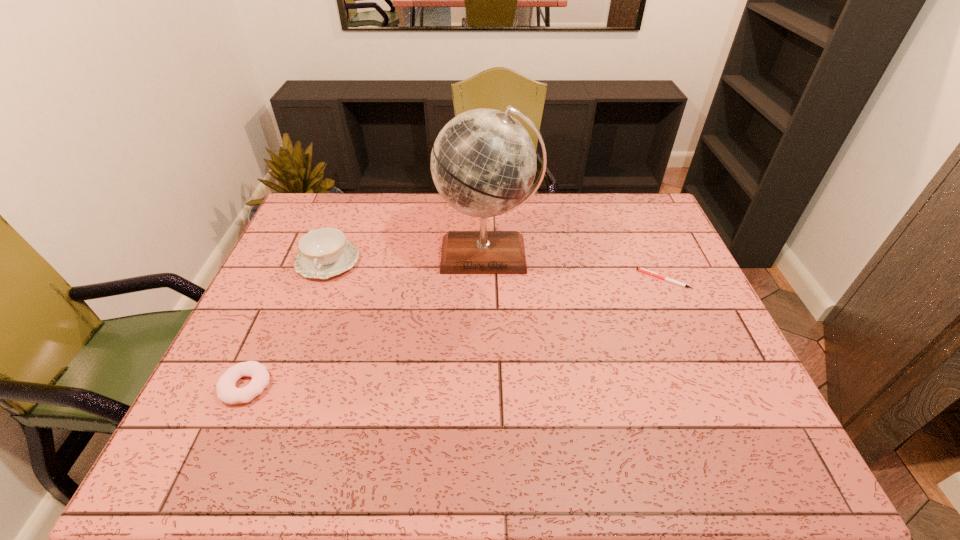
This screenshot has width=960, height=540. I want to click on vacant area at the far left corner of the desktop, so click(x=325, y=210).

Where is `empty location between the doughnut and the chinaware`? empty location between the doughnut and the chinaware is located at coordinates (287, 323).

At what (x,y) coordinates should I click in order to perform the action: click on free point between the tallest object and the nearest object. Please return your answer as a coordinate pair (x, y). The width and height of the screenshot is (960, 540). Looking at the image, I should click on (367, 320).

Locate an element on the screen. The image size is (960, 540). vacant point located between the third tallest object and the pen is located at coordinates (455, 333).

This screenshot has height=540, width=960. I want to click on free point between the doughnut and the shortest object, so click(455, 333).

Find the location of a particular element. unoccupied position between the nearest object and the pen is located at coordinates coord(455,333).

The width and height of the screenshot is (960, 540). Identify the location of free space between the third object from left to right and the chinaware. (407, 258).

Find the location of a particular element. The width and height of the screenshot is (960, 540). vacant space that is in between the nearest object and the chinaware is located at coordinates (287, 323).

Locate an element on the screen. free space between the second tallest object and the doughnut is located at coordinates (287, 323).

I want to click on vacant area between the pen and the second object from right to left, so click(x=575, y=267).